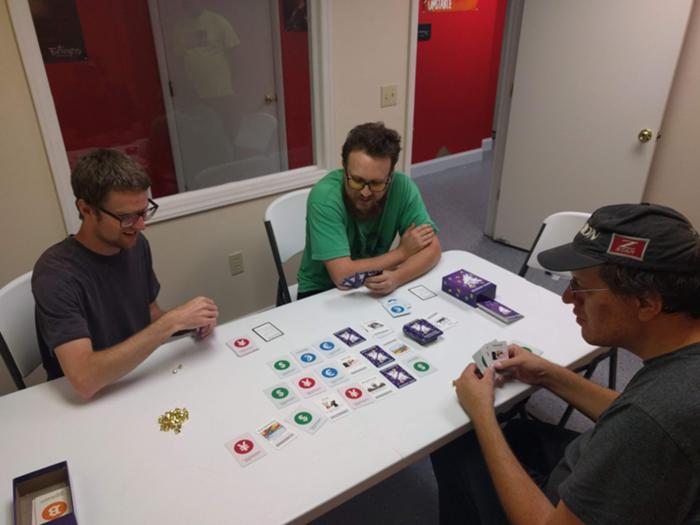
This screenshot has width=700, height=525. Identify the location of door handle. (271, 94), (644, 133).